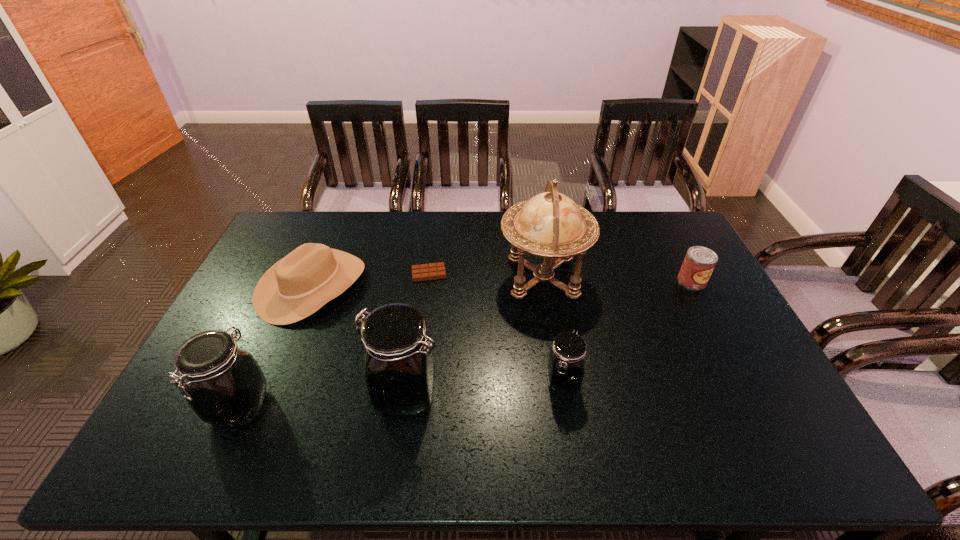
This screenshot has height=540, width=960. What are the coordinates of `cowboy hat located at the left edge` in the screenshot? It's located at (299, 284).

This screenshot has height=540, width=960. What are the coordinates of `object situated at the right edge` in the screenshot? It's located at (698, 265).

Where is `object that is at the near left corner`? object that is at the near left corner is located at coordinates (224, 385).

The image size is (960, 540). In the image, there is a desktop. In order to click on vacant space at the far edge in this screenshot , I will do `click(623, 248)`.

At what (x,y) coordinates should I click in order to perform the action: click on vacant space at the right edge of the desktop. Please return your answer as a coordinate pair (x, y). Image resolution: width=960 pixels, height=540 pixels. Looking at the image, I should click on (722, 295).

Find the location of a particular element. This screenshot has width=960, height=540. vacant region at the far left corner of the desktop is located at coordinates (307, 228).

In the image, there is a desktop. Where is `free space at the far right corner`? The height and width of the screenshot is (540, 960). free space at the far right corner is located at coordinates (642, 223).

Locate an element on the screen. The image size is (960, 540). vacant space at the near right corner of the desktop is located at coordinates (765, 417).

The width and height of the screenshot is (960, 540). I want to click on vacant area that lies between the tallest object and the cowboy hat, so click(x=428, y=282).

The width and height of the screenshot is (960, 540). Find the location of `free space between the cowboy hat and the second jar from right to left`. free space between the cowboy hat and the second jar from right to left is located at coordinates (359, 340).